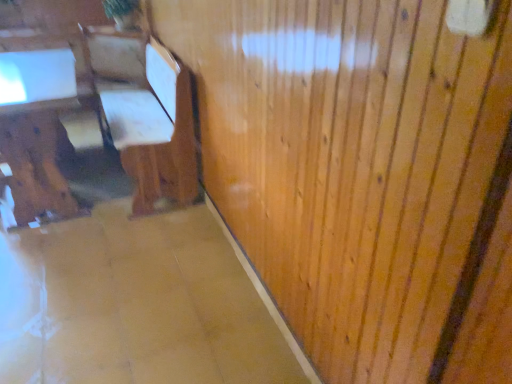
Question: Is wooden chair at left at the right side of matte brown table at left?

Choices:
 (A) yes
 (B) no

Answer: (A)

Question: Is wooden chair at left next to matte brown table at left?

Choices:
 (A) no
 (B) yes

Answer: (A)

Question: Can you confirm if wooden chair at left is positioned to the left of matte brown table at left?

Choices:
 (A) yes
 (B) no

Answer: (B)

Question: From the image's perspective, is wooden chair at left on matte brown table at left?

Choices:
 (A) no
 (B) yes

Answer: (B)

Question: Would you say matte brown table at left is part of wooden chair at left's contents?

Choices:
 (A) no
 (B) yes

Answer: (B)

Question: Can you confirm if wooden chair at left is smaller than matte brown table at left?

Choices:
 (A) no
 (B) yes

Answer: (A)

Question: Considering the relative positions of matte brown table at left and wooden chair at left in the image provided, is matte brown table at left in front of wooden chair at left?

Choices:
 (A) no
 (B) yes

Answer: (A)

Question: Considering the relative sizes of matte brown table at left and wooden chair at left in the image provided, is matte brown table at left shorter than wooden chair at left?

Choices:
 (A) no
 (B) yes

Answer: (B)

Question: From a real-world perspective, is matte brown table at left below wooden chair at left?

Choices:
 (A) yes
 (B) no

Answer: (A)

Question: Can you confirm if matte brown table at left is smaller than wooden chair at left?

Choices:
 (A) yes
 (B) no

Answer: (A)

Question: Is the position of matte brown table at left more distant than that of wooden chair at left?

Choices:
 (A) no
 (B) yes

Answer: (B)

Question: Can you confirm if matte brown table at left is positioned to the left of wooden chair at left?

Choices:
 (A) no
 (B) yes

Answer: (B)

Question: From the image's perspective, is wooden chair at left above or below matte brown table at left?

Choices:
 (A) above
 (B) below

Answer: (A)